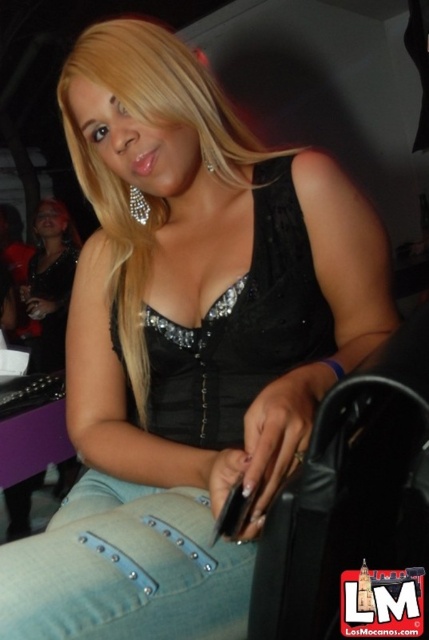
Question: Can you confirm if jeans at lower left is positioned to the right of matte black dress at center?

Choices:
 (A) yes
 (B) no

Answer: (A)

Question: Does jeans at lower left appear over matte black dress at center?

Choices:
 (A) no
 (B) yes

Answer: (A)

Question: Is jeans at lower left positioned in front of matte black dress at center?

Choices:
 (A) no
 (B) yes

Answer: (B)

Question: Which point is closer to the camera taking this photo?

Choices:
 (A) (51, 630)
 (B) (53, 358)

Answer: (A)